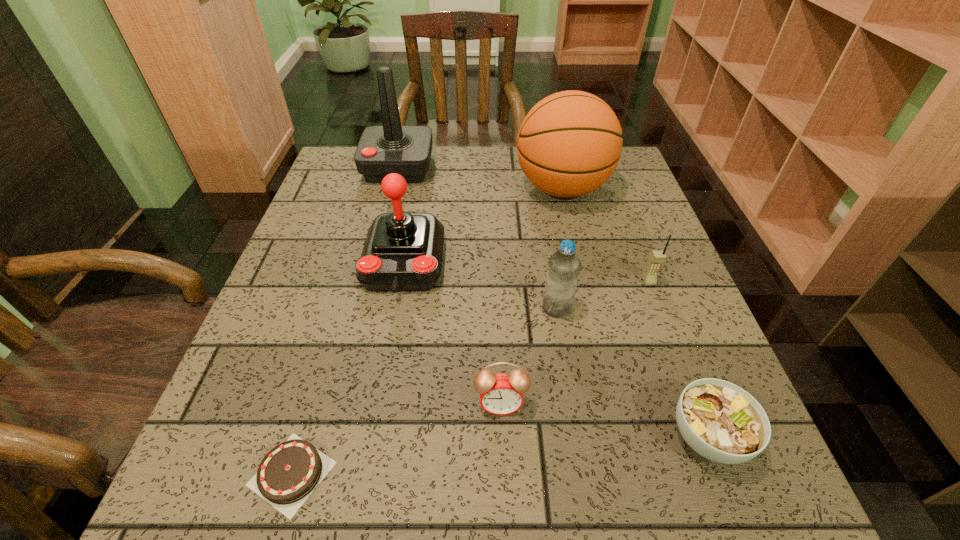
At what (x,y) coordinates should I click in order to perform the action: click on blank area in the image that satisfies the following two spatial constraints: 1. on the back side of the chocolate cake; 2. on the left side of the fourth tallest object. Please return your answer as a coordinate pair (x, y). Looking at the image, I should click on [x=341, y=308].